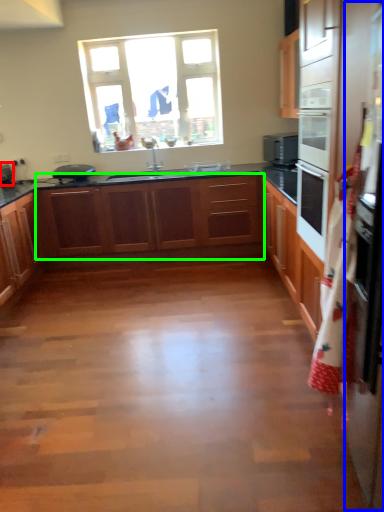
Question: Which object is positioned closest to appliance (highlighted by a red box)? Select from fridge (highlighted by a blue box) and cabinetry (highlighted by a green box).

Choices:
 (A) fridge
 (B) cabinetry

Answer: (B)